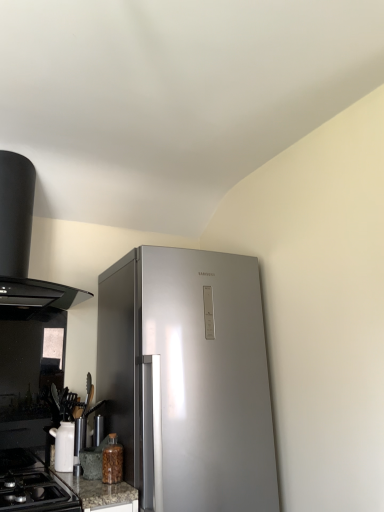
What do you see at coordinates (112, 461) in the screenshot? Image resolution: width=384 pixels, height=512 pixels. I see `translucent glass jar at lower left` at bounding box center [112, 461].

What is the approximate width of white glossy teapot at lower left?

7.40 inches.

The height and width of the screenshot is (512, 384). Describe the element at coordinates (64, 446) in the screenshot. I see `white glossy teapot at lower left` at that location.

What do you see at coordinates (24, 247) in the screenshot?
I see `black matte range hood at upper left` at bounding box center [24, 247].

The image size is (384, 512). I want to click on translucent glass jar at lower left, so click(112, 461).

Could you tell me if translucent glass jar at lower left is facing black glass gas stove at lower left?

No.

From a real-world perspective, is translucent glass jar at lower left beneath black glass gas stove at lower left?

No.

How many degrees apart are the facing directions of translucent glass jar at lower left and black glass gas stove at lower left?

The angle between the facing direction of translucent glass jar at lower left and the facing direction of black glass gas stove at lower left is 3.89 degrees.

From the image's perspective, who appears lower, translucent glass jar at lower left or black glass gas stove at lower left?

black glass gas stove at lower left, from the image's perspective.

Considering the sizes of objects black matte range hood at upper left and translucent glass jar at lower left in the image provided, who is bigger, black matte range hood at upper left or translucent glass jar at lower left?

black matte range hood at upper left is bigger.

From the image's perspective, is black matte range hood at upper left on top of translucent glass jar at lower left?

Yes, from the image's perspective, black matte range hood at upper left is on top of translucent glass jar at lower left.

Is black matte range hood at upper left oriented towards translucent glass jar at lower left?

No, black matte range hood at upper left is not oriented towards translucent glass jar at lower left.

Does point (34, 283) appear closer or farther from the camera than point (111, 480)?

Point (34, 283).

Locate an element on the screen. kitchen appliance located above the white glossy teapot at lower left (from a real-world perspective) is located at coordinates (24, 247).

Is white glossy teapot at lower left to the left of black matte range hood at upper left from the viewer's perspective?

In fact, white glossy teapot at lower left is to the right of black matte range hood at upper left.

From the image's perspective, is white glossy teapot at lower left on black matte range hood at upper left?

No.

Could you tell me if white glossy teapot at lower left is turned towards black glass gas stove at lower left?

No, white glossy teapot at lower left is not turned towards black glass gas stove at lower left.

From a real-world perspective, is white glossy teapot at lower left positioned over black glass gas stove at lower left based on gravity?

Yes, from a real-world perspective, white glossy teapot at lower left is above black glass gas stove at lower left.

In order to click on gas stove located on the left of white glossy teapot at lower left in this screenshot , I will do `click(37, 494)`.

From the image's perspective, is translucent glass jar at lower left on white glossy teapot at lower left?

Yes, from the image's perspective, translucent glass jar at lower left is above white glossy teapot at lower left.

How many degrees apart are the facing directions of translucent glass jar at lower left and white glossy teapot at lower left?

translucent glass jar at lower left and white glossy teapot at lower left are facing 0.000334 degrees away from each other.

Considering the sizes of objects translucent glass jar at lower left and white glossy teapot at lower left in the image provided, who is thinner, translucent glass jar at lower left or white glossy teapot at lower left?

translucent glass jar at lower left.

Which object is further away from the camera, translucent glass jar at lower left or white glossy teapot at lower left?

white glossy teapot at lower left.

Who is shorter, black matte range hood at upper left or black glass gas stove at lower left?

black glass gas stove at lower left is shorter.

Considering the relative sizes of black matte range hood at upper left and black glass gas stove at lower left in the image provided, is black matte range hood at upper left wider than black glass gas stove at lower left?

No, black matte range hood at upper left is not wider than black glass gas stove at lower left.

Find the location of a particular element. kitchen appliance that is above the black glass gas stove at lower left (from a real-world perspective) is located at coordinates (24, 247).

Considering the relative positions of white glossy teapot at lower left and translucent glass jar at lower left in the image provided, is white glossy teapot at lower left to the left of translucent glass jar at lower left from the viewer's perspective?

Yes.

Does white glossy teapot at lower left turn towards translucent glass jar at lower left?

No, white glossy teapot at lower left is not aimed at translucent glass jar at lower left.

How different are the orientations of white glossy teapot at lower left and translucent glass jar at lower left in degrees?

They differ by 0.000334 degrees in their facing directions.

Based on their sizes in the image, would you say white glossy teapot at lower left is bigger or smaller than translucent glass jar at lower left?

Clearly, white glossy teapot at lower left is larger in size than translucent glass jar at lower left.

The height and width of the screenshot is (512, 384). What are the coordinates of `bottle behind the black glass gas stove at lower left` in the screenshot? It's located at (112, 461).

Find the location of a particular element. The image size is (384, 512). kitchen appliance lying above the translucent glass jar at lower left (from the image's perspective) is located at coordinates (24, 247).

When comparing their distances from black matte range hood at upper left, does translucent glass jar at lower left or black glass gas stove at lower left seem further?

translucent glass jar at lower left lies further to black matte range hood at upper left than the other object.

Looking at the image, which one is located closer to white glossy teapot at lower left, black glass gas stove at lower left or translucent glass jar at lower left?

The object closer to white glossy teapot at lower left is black glass gas stove at lower left.

Estimate the real-world distances between objects in this image. Which object is further from black glass gas stove at lower left, white glossy teapot at lower left or translucent glass jar at lower left?

The object further to black glass gas stove at lower left is white glossy teapot at lower left.

Looking at the image, which one is located further to black glass gas stove at lower left, white glossy teapot at lower left or black matte range hood at upper left?

black matte range hood at upper left.

Which object lies further to the anchor point translucent glass jar at lower left, black matte range hood at upper left or white glossy teapot at lower left?

black matte range hood at upper left.

Looking at the image, which one is located closer to translucent glass jar at lower left, black glass gas stove at lower left or black matte range hood at upper left?

black glass gas stove at lower left is closer to translucent glass jar at lower left.

Looking at the image, which one is located further to black glass gas stove at lower left, translucent glass jar at lower left or black matte range hood at upper left?

Among the two, black matte range hood at upper left is located further to black glass gas stove at lower left.

When comparing their distances from translucent glass jar at lower left, does white glossy teapot at lower left or black glass gas stove at lower left seem further?

white glossy teapot at lower left is further to translucent glass jar at lower left.

Locate an element on the screen. This screenshot has height=512, width=384. appliance between black matte range hood at upper left and black glass gas stove at lower left vertically is located at coordinates (64, 446).

You are a GUI agent. You are given a task and a screenshot of the screen. Output one action in this format:
    pyautogui.click(x=<x>, y=<y>)
    Task: Click on the bottle between black matte range hood at upper left and white glossy teapot at lower left in the up-down direction
    
    Given the screenshot: What is the action you would take?
    pyautogui.click(x=112, y=461)

Identify the location of bottle between black matte range hood at upper left and black glass gas stove at lower left from top to bottom. point(112,461).

Identify the location of bottle between black glass gas stove at lower left and white glossy teapot at lower left from front to back. This screenshot has width=384, height=512. (112, 461).